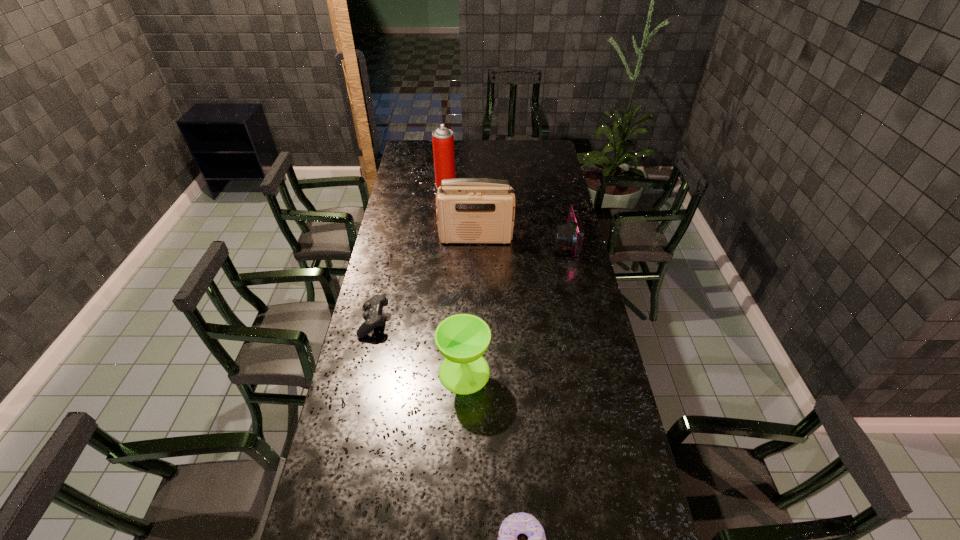
The height and width of the screenshot is (540, 960). Identify the location of aerosol can. (442, 138).

Image resolution: width=960 pixels, height=540 pixels. What are the coordinates of `radio receiver` in the screenshot? It's located at (469, 210).

You are a GUI agent. You are given a task and a screenshot of the screen. Output one action in this format:
    pyautogui.click(x=<x>, y=<y>)
    Task: Click on the fifth farthest object
    
    Given the screenshot: What is the action you would take?
    pyautogui.click(x=462, y=339)

Find the location of `the third tallest object`. the third tallest object is located at coordinates (462, 339).

At what (x,y) coordinates should I click in order to perform the action: click on the third shortest object. Please return your answer as a coordinate pair (x, y). The width and height of the screenshot is (960, 540). Looking at the image, I should click on (571, 234).

Where is `the rightmost object`? the rightmost object is located at coordinates (571, 234).

What are the coordinates of `control` in the screenshot? It's located at (373, 318).

Where is `the leftmost object`? the leftmost object is located at coordinates (373, 318).

Where is `vacant space located on the back of the farthest object`? vacant space located on the back of the farthest object is located at coordinates (448, 160).

Where is `vacant space located on the front-facing side of the radio receiver`? The width and height of the screenshot is (960, 540). vacant space located on the front-facing side of the radio receiver is located at coordinates (475, 306).